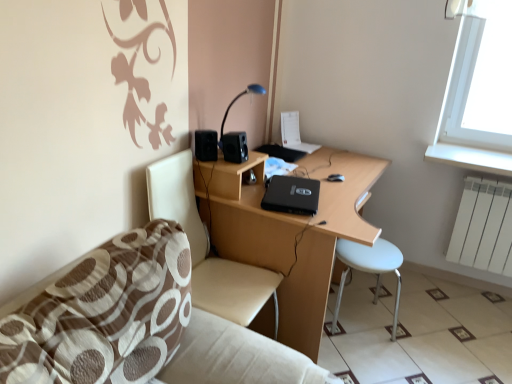
Find the location of a particular element. vacant space to the right of white plastic stool at lower right is located at coordinates (425, 328).